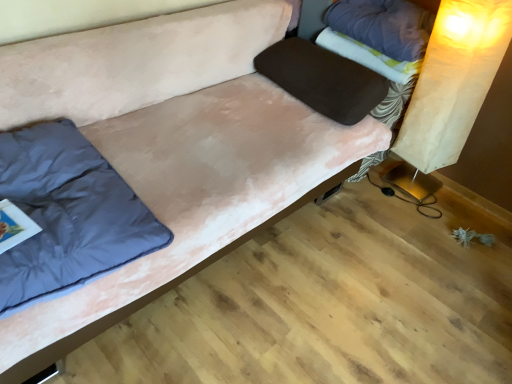
Question: Is dark blue fabric pillow at left, marked as the 3th pillow in a right-to-left arrangement, located outside velvet brown pillow at center, which is counted as the 2th pillow, starting from the left?

Choices:
 (A) yes
 (B) no

Answer: (A)

Question: Is dark blue fabric pillow at left, the first pillow from the left, not near velvet brown pillow at center, which is counted as the 2th pillow, starting from the left?

Choices:
 (A) no
 (B) yes

Answer: (B)

Question: Considering the relative sizes of dark blue fabric pillow at left, marked as the 3th pillow in a right-to-left arrangement, and velvet brown pillow at center, the 2th pillow from the right, in the image provided, is dark blue fabric pillow at left, marked as the 3th pillow in a right-to-left arrangement, bigger than velvet brown pillow at center, the 2th pillow from the right,?

Choices:
 (A) no
 (B) yes

Answer: (B)

Question: Can you confirm if dark blue fabric pillow at left, the first pillow from the left, is wider than velvet brown pillow at center, the 2th pillow from the right?

Choices:
 (A) no
 (B) yes

Answer: (B)

Question: Does dark blue fabric pillow at left, marked as the 3th pillow in a right-to-left arrangement, have a lesser width compared to velvet brown pillow at center, which is counted as the 2th pillow, starting from the left?

Choices:
 (A) yes
 (B) no

Answer: (B)

Question: Based on their positions, is purple fabric pillow at upper right, which is the third pillow in left-to-right order, located to the left or right of velvet brown pillow at center, the 2th pillow from the right?

Choices:
 (A) right
 (B) left

Answer: (A)

Question: Is point (414, 29) closer or farther from the camera than point (308, 69)?

Choices:
 (A) closer
 (B) farther

Answer: (A)

Question: From the image's perspective, is purple fabric pillow at upper right, which is the third pillow in left-to-right order, located above or below velvet brown pillow at center, which is counted as the 2th pillow, starting from the left?

Choices:
 (A) above
 (B) below

Answer: (A)

Question: From a real-world perspective, relative to velvet brown pillow at center, which is counted as the 2th pillow, starting from the left, is purple fabric pillow at upper right, which is counted as the first pillow, starting from the right, vertically above or below?

Choices:
 (A) below
 (B) above

Answer: (B)

Question: Is fluffy white blanket at upper right in front of or behind matte paper lampshade at right in the image?

Choices:
 (A) behind
 (B) front

Answer: (A)

Question: From a real-world perspective, relative to matte paper lampshade at right, is fluffy white blanket at upper right vertically above or below?

Choices:
 (A) below
 (B) above

Answer: (B)

Question: Does point (380, 67) appear closer or farther from the camera than point (503, 152)?

Choices:
 (A) farther
 (B) closer

Answer: (B)

Question: Looking at the image, does fluffy white blanket at upper right seem bigger or smaller compared to matte paper lampshade at right?

Choices:
 (A) big
 (B) small

Answer: (B)

Question: In terms of height, does dark blue fabric pillow at left, the first pillow from the left, look taller or shorter compared to matte paper lampshade at right?

Choices:
 (A) tall
 (B) short

Answer: (B)

Question: In terms of width, does dark blue fabric pillow at left, the first pillow from the left, look wider or thinner when compared to matte paper lampshade at right?

Choices:
 (A) wide
 (B) thin

Answer: (A)